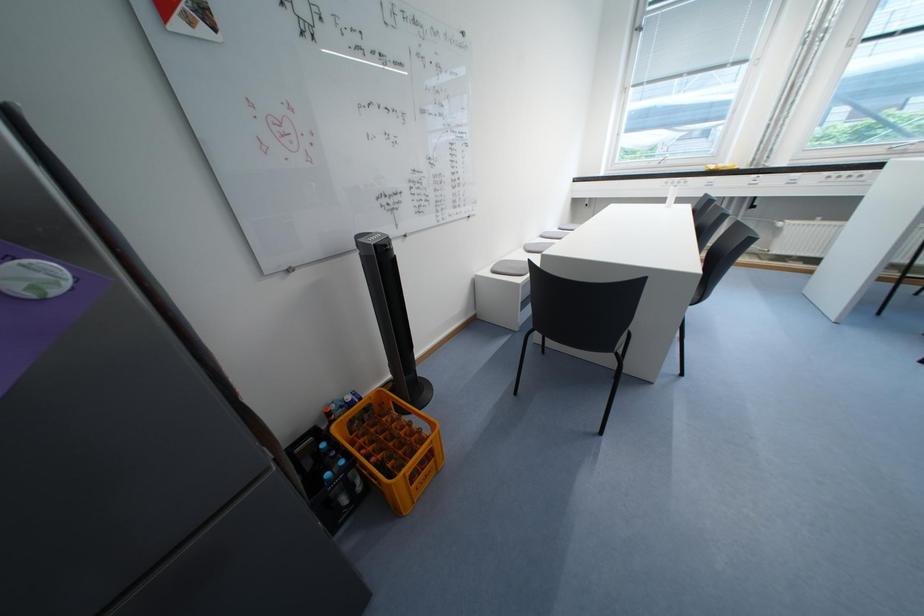
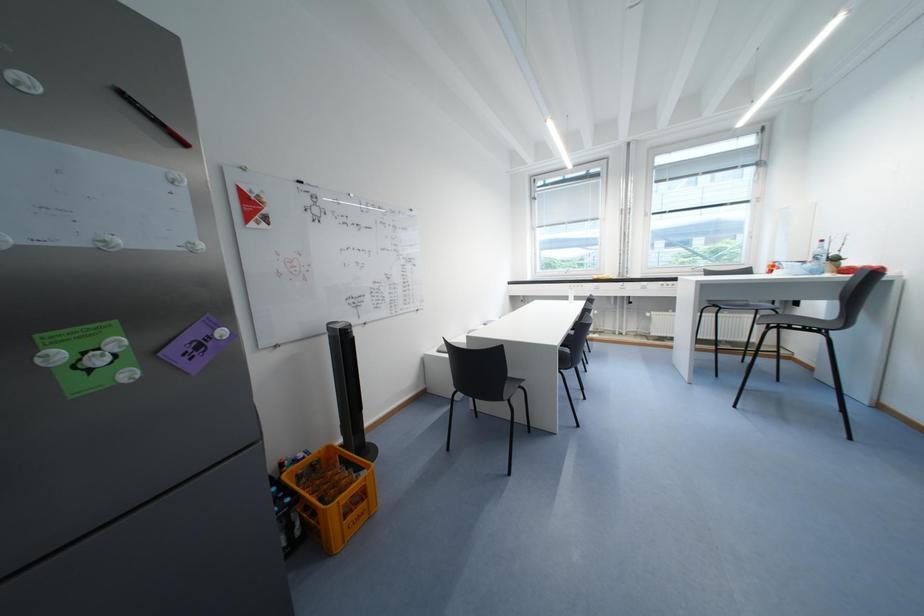
In a continuous first-person perspective shot, in which direction is the camera moving?

The cameraman walked toward right, backward.